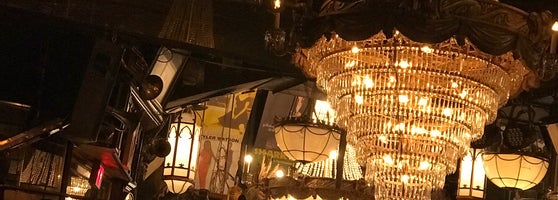
Identify the location of half globe lamp shade. click(x=316, y=145), click(x=290, y=143), click(x=535, y=170), click(x=508, y=172), click(x=490, y=166).